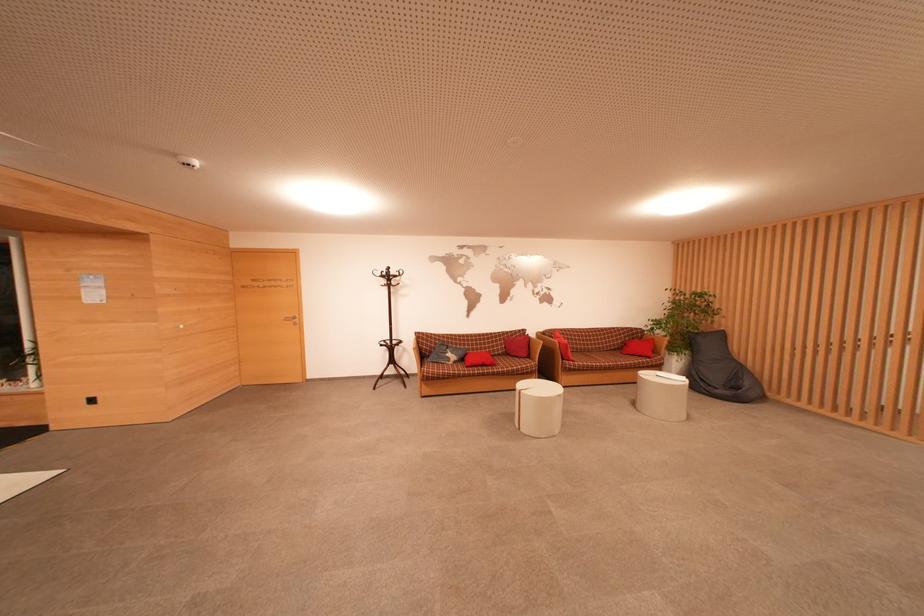
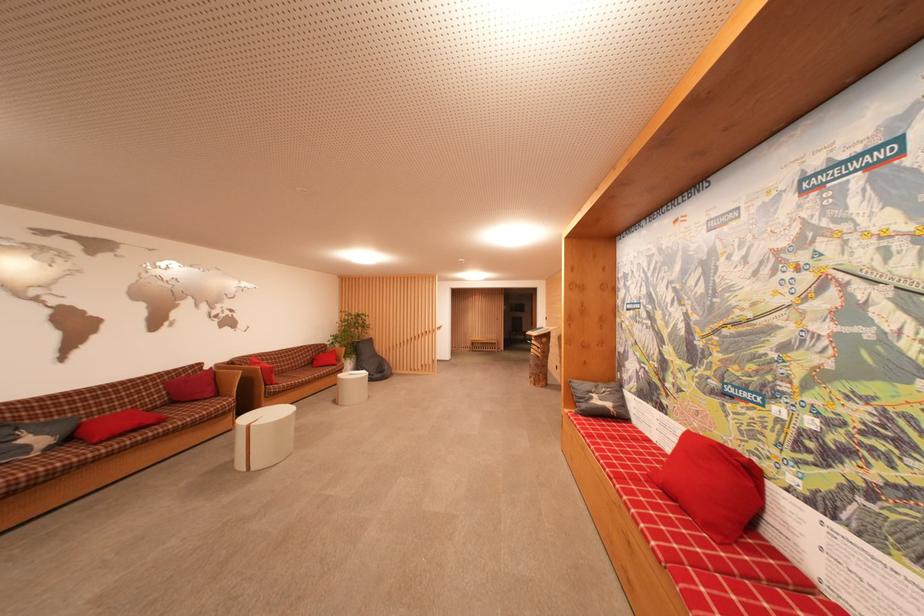
Find the pixel in the second image that matches pixel 548 336 in the first image.

(235, 366)